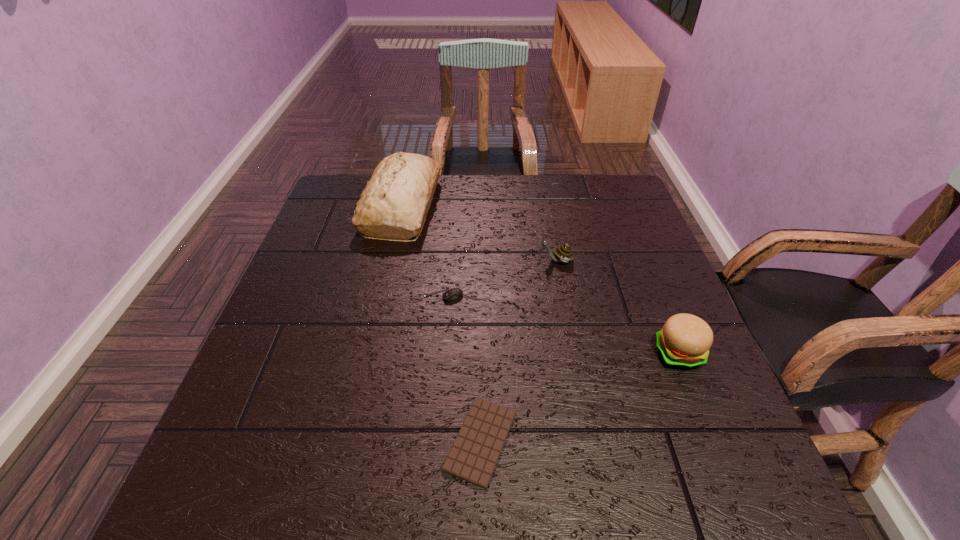
Where is `object located in the right edge section of the desktop`? This screenshot has width=960, height=540. object located in the right edge section of the desktop is located at coordinates (684, 342).

At what (x,y) coordinates should I click in order to perform the action: click on object that is positioned at the far left corner. Please return your answer as a coordinate pair (x, y). This screenshot has height=540, width=960. Looking at the image, I should click on (394, 204).

Locate an element on the screen. vacant space at the far edge of the desktop is located at coordinates point(485,190).

The image size is (960, 540). Find the location of `vacant space at the near edge`. vacant space at the near edge is located at coordinates (644, 474).

Where is `free region at the left edge`? This screenshot has width=960, height=540. free region at the left edge is located at coordinates (338, 338).

This screenshot has height=540, width=960. Identify the location of blank space at the right edge. (692, 442).

Locate an element on the screen. The height and width of the screenshot is (540, 960). free spot at the far right corner of the desktop is located at coordinates click(x=589, y=186).

Where is `free space between the nearest object and the rightmost object`? The width and height of the screenshot is (960, 540). free space between the nearest object and the rightmost object is located at coordinates (580, 397).

Where is `vacant area that lies between the tallest object and the fourth nearest object`? The width and height of the screenshot is (960, 540). vacant area that lies between the tallest object and the fourth nearest object is located at coordinates (479, 233).

The height and width of the screenshot is (540, 960). Identify the location of vacant area that lies between the fourth object from left to right and the fourth tallest object. (500, 279).